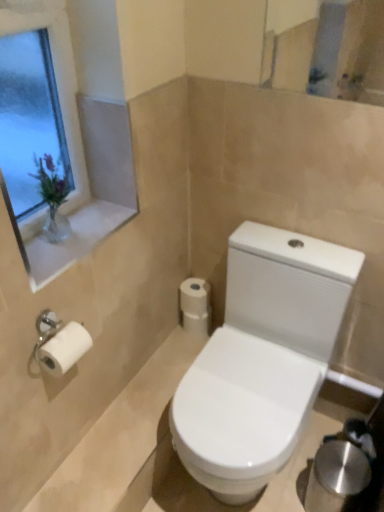
At what (x,y) coordinates should I click in order to perform the action: click on free point above white glossy window sill at upper left (from a real-world perspective). Please return your answer as a coordinate pair (x, y). The image size is (384, 512). Looking at the image, I should click on pos(74,231).